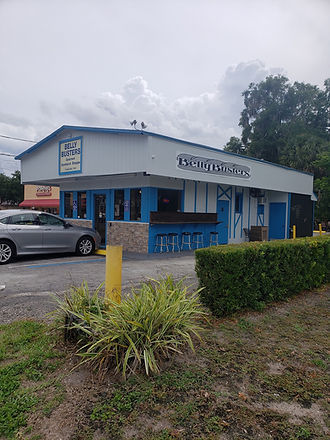
I want to click on brick wall, so click(x=135, y=227), click(x=85, y=224).